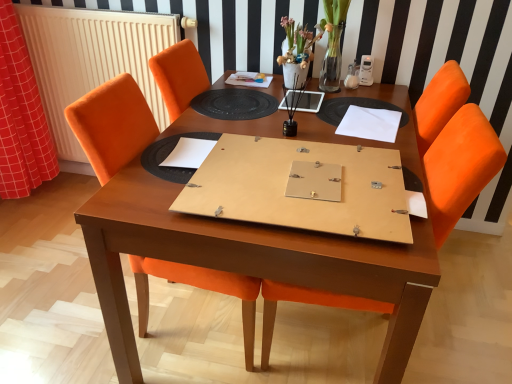
At what (x,y) coordinates should I click in order to perform the action: click on vacant point above wooden table at center (from a real-world perspective). Please return your answer as a coordinate pair (x, y). This screenshot has height=384, width=512. Looking at the image, I should click on (293, 124).